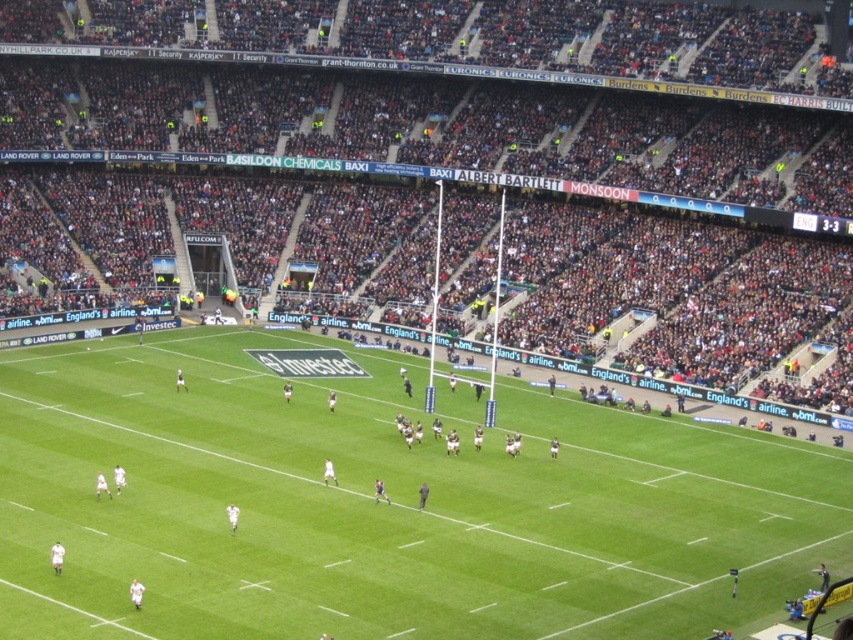
Does dark gray stadium seats at center appear over green grass football field at center?

Correct, dark gray stadium seats at center is located above green grass football field at center.

Measure the distance between dark gray stadium seats at center and camera.

A distance of 228.40 feet exists between dark gray stadium seats at center and camera.

Is point (656, 273) positioned in front of point (780, 580)?

No, it is behind (780, 580).

Find the location of a particular element. dark gray stadium seats at center is located at coordinates (509, 154).